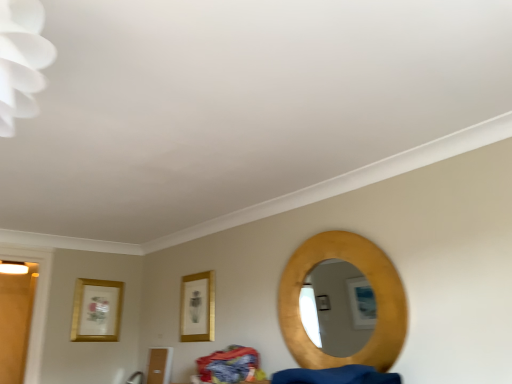
Question: Considering the positions of gold metallic picture frame at center, arranged as the first picture frame when viewed from the right, and gold textured mirror at right in the image, is gold metallic picture frame at center, arranged as the first picture frame when viewed from the right, wider or thinner than gold textured mirror at right?

Choices:
 (A) thin
 (B) wide

Answer: (A)

Question: Does point (189, 296) appear closer or farther from the camera than point (297, 312)?

Choices:
 (A) closer
 (B) farther

Answer: (B)

Question: Based on their relative distances, which object is nearer to the gold metallic picture frame at center, the 2th picture frame in the back-to-front sequence?

Choices:
 (A) gold metallic picture frame at left, which is the first picture frame in back-to-front order
 (B) gold textured mirror at right

Answer: (A)

Question: Estimate the real-world distances between objects in this image. Which object is closer to the gold metallic picture frame at left, the second picture frame from the right?

Choices:
 (A) gold textured mirror at right
 (B) gold metallic picture frame at center, the 1th picture frame in the front-to-back sequence

Answer: (B)